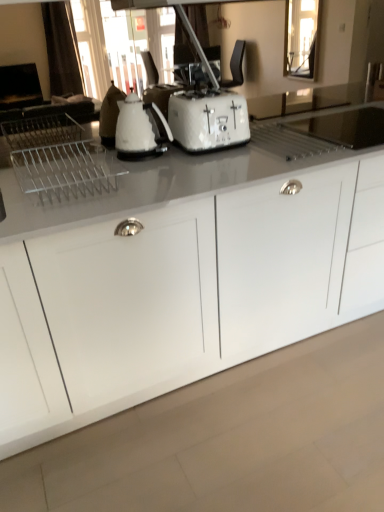
Question: From the image's perspective, would you say white textured toaster at center is positioned over white glossy kettle at center?

Choices:
 (A) yes
 (B) no

Answer: (A)

Question: Does white textured toaster at center appear on the left side of white glossy kettle at center?

Choices:
 (A) yes
 (B) no

Answer: (B)

Question: From the image's perspective, is white textured toaster at center beneath white glossy kettle at center?

Choices:
 (A) yes
 (B) no

Answer: (B)

Question: From a real-world perspective, is white textured toaster at center on white glossy kettle at center?

Choices:
 (A) no
 (B) yes

Answer: (A)

Question: Can you confirm if white textured toaster at center is wider than white glossy kettle at center?

Choices:
 (A) no
 (B) yes

Answer: (B)

Question: Is white textured toaster at center thinner than white glossy kettle at center?

Choices:
 (A) no
 (B) yes

Answer: (A)

Question: Is white glossy cabinet at center far from white textured toaster at center?

Choices:
 (A) yes
 (B) no

Answer: (B)

Question: From a real-world perspective, is white glossy cabinet at center beneath white textured toaster at center?

Choices:
 (A) yes
 (B) no

Answer: (A)

Question: From the image's perspective, is white glossy cabinet at center on top of white textured toaster at center?

Choices:
 (A) yes
 (B) no

Answer: (B)

Question: Would you say white glossy cabinet at center contains white textured toaster at center?

Choices:
 (A) yes
 (B) no

Answer: (B)

Question: Does white glossy cabinet at center come behind white textured toaster at center?

Choices:
 (A) no
 (B) yes

Answer: (A)

Question: Is white glossy cabinet at center looking in the opposite direction of white textured toaster at center?

Choices:
 (A) no
 (B) yes

Answer: (A)

Question: From a real-world perspective, is white glossy kettle at center physically below white glossy cabinet at center?

Choices:
 (A) yes
 (B) no

Answer: (B)